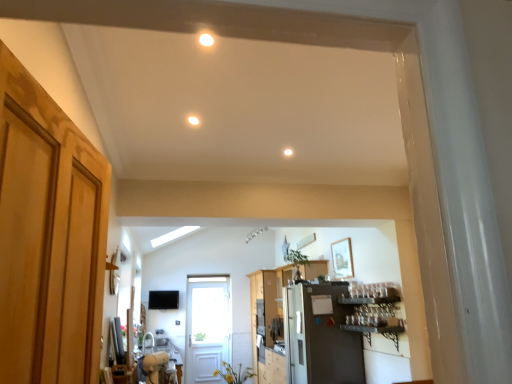
You are a GUI agent. You are given a task and a screenshot of the screen. Output one action in this format:
    pyautogui.click(x=<x>, y=<y>)
    Task: Click on the free space to the left of white matte light fixture at center, the first lighting in the bottom-to-top sequence
    The image size is (512, 384).
    Given the screenshot: What is the action you would take?
    pyautogui.click(x=271, y=153)